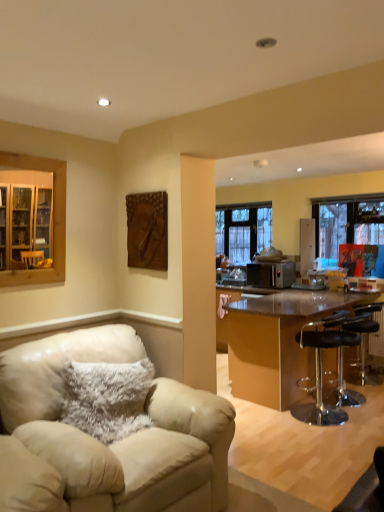
Question: From the image's perspective, does black leather bar stool at right, which ranks as the second chair in front-to-back order, appear lower than transparent plastic bar stool at right, which ranks as the 3th chair in front-to-back order?

Choices:
 (A) no
 (B) yes

Answer: (A)

Question: Is the surface of black leather bar stool at right, which ranks as the second chair in front-to-back order, in direct contact with transparent plastic bar stool at right, which ranks as the 3th chair in front-to-back order?

Choices:
 (A) no
 (B) yes

Answer: (A)

Question: From the image's perspective, would you say black leather bar stool at right, the 3th chair from the back, is positioned over transparent plastic bar stool at right, which ranks as the 3th chair in front-to-back order?

Choices:
 (A) no
 (B) yes

Answer: (B)

Question: Considering the relative sizes of black leather bar stool at right, the second chair in the left-to-right sequence, and transparent plastic bar stool at right, marked as the 3th chair in a left-to-right arrangement, in the image provided, is black leather bar stool at right, the second chair in the left-to-right sequence, smaller than transparent plastic bar stool at right, marked as the 3th chair in a left-to-right arrangement,?

Choices:
 (A) yes
 (B) no

Answer: (B)

Question: Is black leather bar stool at right, the second chair in the left-to-right sequence, oriented towards transparent plastic bar stool at right, marked as the 3th chair in a left-to-right arrangement?

Choices:
 (A) yes
 (B) no

Answer: (B)

Question: Does point (311, 404) appear closer or farther from the camera than point (286, 279)?

Choices:
 (A) closer
 (B) farther

Answer: (A)

Question: Is black leather bar stool at right, the 3th chair from the back, wider or thinner than satin silver toaster at center?

Choices:
 (A) wide
 (B) thin

Answer: (A)

Question: From a real-world perspective, is black leather bar stool at right, which ranks as the second chair in front-to-back order, physically located above or below satin silver toaster at center?

Choices:
 (A) above
 (B) below

Answer: (B)

Question: Is black leather bar stool at right, the 3th chair from the back, inside or outside of satin silver toaster at center?

Choices:
 (A) outside
 (B) inside

Answer: (A)

Question: From a real-world perspective, relative to clear glass window at center, the 2th window in the front-to-back sequence, is wooden carving at upper center vertically above or below?

Choices:
 (A) below
 (B) above

Answer: (B)

Question: Is wooden carving at upper center situated inside clear glass window at center, positioned as the second window in right-to-left order, or outside?

Choices:
 (A) inside
 (B) outside

Answer: (B)

Question: Based on their sizes in the image, would you say wooden carving at upper center is bigger or smaller than clear glass window at center, the 1th window positioned from the back?

Choices:
 (A) big
 (B) small

Answer: (B)

Question: From the image's perspective, is wooden carving at upper center positioned above or below clear glass window at center, acting as the first window starting from the left?

Choices:
 (A) below
 (B) above

Answer: (A)

Question: Is beige leather chair at lower left, which ranks as the fourth chair in right-to-left order, to the left or to the right of black leather bar stool at right, positioned as the third chair in right-to-left order, in the image?

Choices:
 (A) left
 (B) right

Answer: (A)

Question: Is beige leather chair at lower left, the first chair from the front, spatially inside black leather bar stool at right, which ranks as the second chair in front-to-back order, or outside of it?

Choices:
 (A) outside
 (B) inside

Answer: (A)